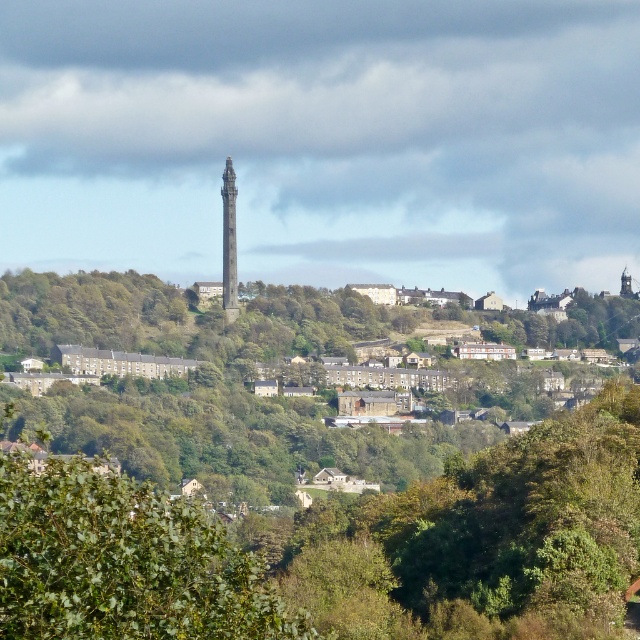
You are an architect analyzing a town layout. The brown stone houses at center are located at coordinates point 0.603, 0.370. How would you describe their position relative to the town center?

The brown stone houses at center are positioned at the town center coordinates point (236, 385).

You are a delivery drone that needs to fly through the space between the brown stone houses at center and the smooth stone tower at center. Can you safely navigate between them if your drone has a wingspan of 1.2 meters?

The brown stone houses at center might be wider than the smooth stone tower at center, so the available space between them could accommodate a drone with a 1.2 meter wingspan, but it depends on the exact width difference. Without precise measurements, it is uncertain.